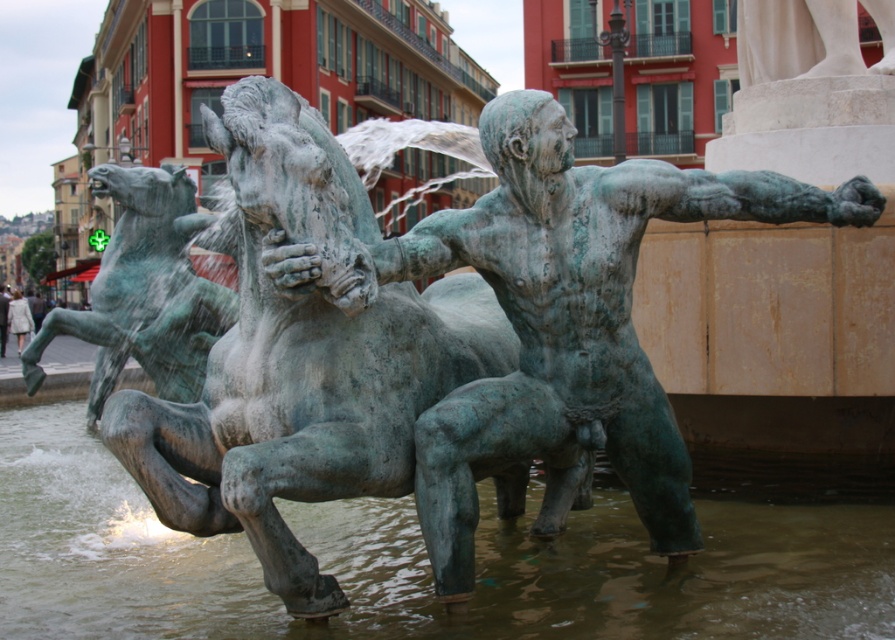
You are standing in front of the bronze sculpture in the public square. You notice two points marked on the sculpture. The first point is at coordinates point (x=735, y=602) and the second is at point (x=97, y=353). Which of these points is nearer to your viewpoint?

Point (x=735, y=602) is closer to the viewer than point (x=97, y=353).

You are an artist planning to photograph the greenish water at horse front and the green patina statue at center from a position where both are visible. Which object will appear larger in your photo?

The greenish water at horse front will appear larger in the photo since it has a larger size compared to the green patina statue at center.